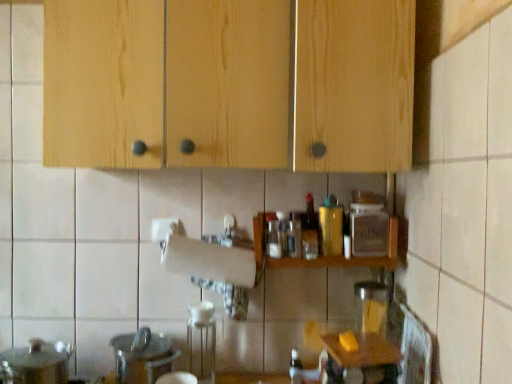
Question: Is translucent glass bottle at lower center, which is counted as the first bottle, starting from the bottom, beside white matte paper towel at center?

Choices:
 (A) no
 (B) yes

Answer: (A)

Question: Does translucent glass bottle at lower center, which is counted as the first bottle, starting from the bottom, lie behind white matte paper towel at center?

Choices:
 (A) no
 (B) yes

Answer: (B)

Question: Does translucent glass bottle at lower center, placed as the 3th bottle when sorted from top to bottom, have a greater height compared to white matte paper towel at center?

Choices:
 (A) no
 (B) yes

Answer: (A)

Question: Would you consider translucent glass bottle at lower center, placed as the 3th bottle when sorted from top to bottom, to be distant from white matte paper towel at center?

Choices:
 (A) no
 (B) yes

Answer: (A)

Question: Does translucent glass bottle at lower center, placed as the 3th bottle when sorted from top to bottom, have a greater width compared to white matte paper towel at center?

Choices:
 (A) yes
 (B) no

Answer: (B)

Question: Looking at the image, does translucent plastic bottle at center, which ranks as the first bottle in top-to-bottom order, seem bigger or smaller compared to white matte paper towel at center?

Choices:
 (A) small
 (B) big

Answer: (A)

Question: Is translucent plastic bottle at center, which ranks as the first bottle in top-to-bottom order, to the left or to the right of white matte paper towel at center in the image?

Choices:
 (A) left
 (B) right

Answer: (B)

Question: Is point (312, 208) closer or farther from the camera than point (201, 246)?

Choices:
 (A) farther
 (B) closer

Answer: (A)

Question: Is translucent plastic bottle at center, which ranks as the first bottle in top-to-bottom order, in front of or behind white matte paper towel at center in the image?

Choices:
 (A) front
 (B) behind

Answer: (B)

Question: From the image's perspective, is gold metallic canister at center, positioned as the 2th bottle in top-to-bottom order, above or below translucent glass bottle at lower center, which is counted as the first bottle, starting from the bottom?

Choices:
 (A) above
 (B) below

Answer: (A)

Question: Based on their positions, is gold metallic canister at center, the 2th bottle ordered from the bottom, located to the left or right of translucent glass bottle at lower center, which is counted as the first bottle, starting from the bottom?

Choices:
 (A) left
 (B) right

Answer: (B)

Question: From their relative heights in the image, would you say gold metallic canister at center, the 2th bottle ordered from the bottom, is taller or shorter than translucent glass bottle at lower center, which is counted as the first bottle, starting from the bottom?

Choices:
 (A) tall
 (B) short

Answer: (A)

Question: From a real-world perspective, is gold metallic canister at center, positioned as the 2th bottle in top-to-bottom order, above or below translucent glass bottle at lower center, placed as the 3th bottle when sorted from top to bottom?

Choices:
 (A) above
 (B) below

Answer: (A)

Question: Is natural wood cabinets at upper center to the left or to the right of white matte paper towel at center in the image?

Choices:
 (A) left
 (B) right

Answer: (B)

Question: In the image, is natural wood cabinets at upper center positioned in front of or behind white matte paper towel at center?

Choices:
 (A) front
 (B) behind

Answer: (A)